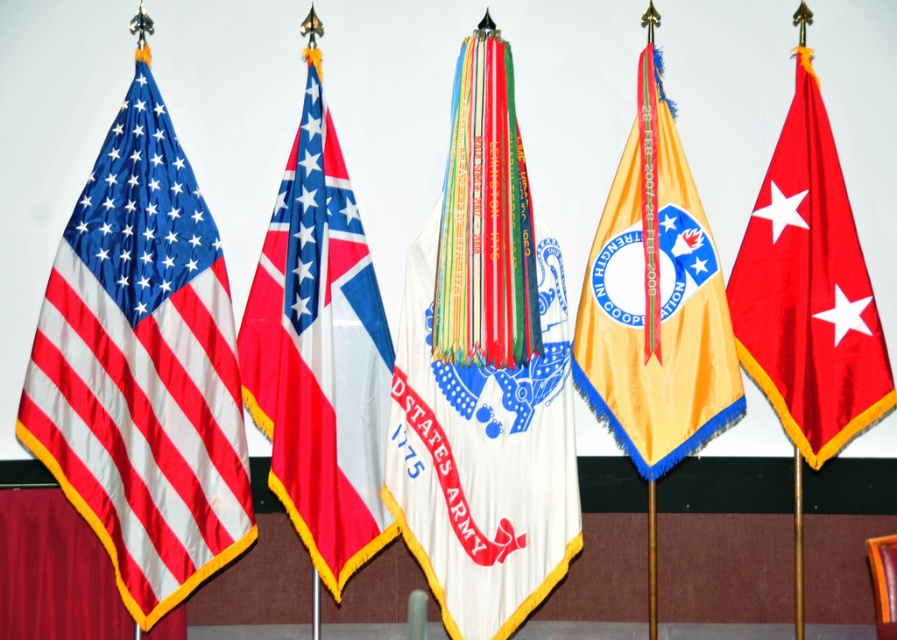
Is point (97, 228) closer to camera compared to point (327, 486)?

That is False.

Which is in front, point (157, 214) or point (332, 563)?

Point (332, 563)

Is point (177, 412) behind point (285, 509)?

Yes.

Find the location of a particular element. The width and height of the screenshot is (897, 640). matte fabric flag at left is located at coordinates (142, 368).

From the picture: Is red and white fabric flag at center taller than shiny red flag at right?

Indeed, red and white fabric flag at center has a greater height compared to shiny red flag at right.

Can you confirm if red and white fabric flag at center is positioned to the right of shiny red flag at right?

In fact, red and white fabric flag at center is to the left of shiny red flag at right.

The height and width of the screenshot is (640, 897). In order to click on red and white fabric flag at center in this screenshot , I will do `click(320, 353)`.

Can you confirm if shiny red flag at right is shorter than orange fabric chair at lower right?

No.

Which of these two, shiny red flag at right or orange fabric chair at lower right, stands shorter?

With less height is orange fabric chair at lower right.

The image size is (897, 640). Identify the location of shiny red flag at right. (808, 289).